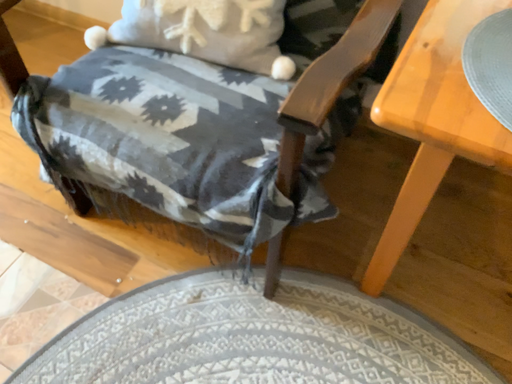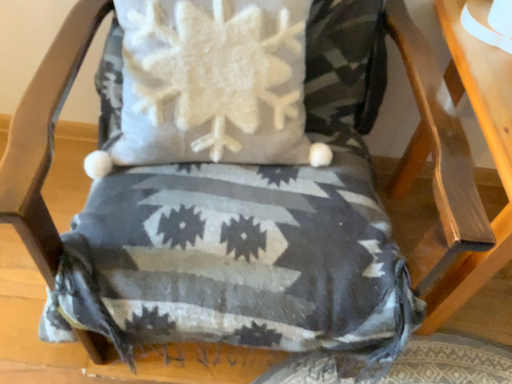
Question: Which way did the camera rotate in the video?

Choices:
 (A) rotated left
 (B) rotated right

Answer: (B)